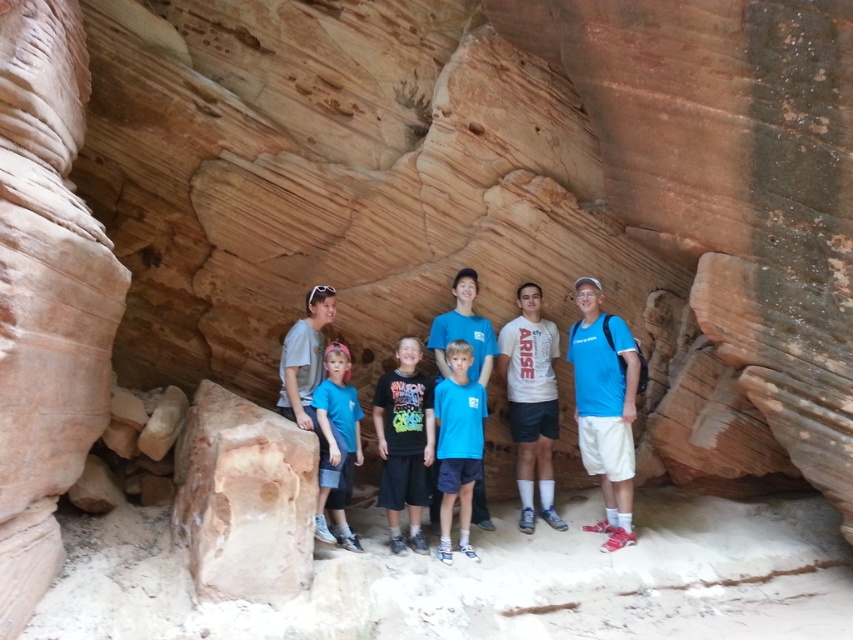
You are standing at the entrance of the rock formation and want to reach the point marked as point (x=407, y=394). If your walking speed is 1.2 meters per second, how many seconds will it take you to reach that point?

The distance between you and point (x=407, y=394) is 9.16 meters. At a speed of 1.2 meters per second, it will take approximately 7.63 seconds to reach the point.

You are navigating through a narrow path between two points in the rock formation. The first point is at coordinate point(601, 362) and the second point is at coordinate point(322, 392). Which point is closer to you as you move forward?

Point(601, 362) is closer to you than point(322, 392) because it is further to the viewer, meaning it is nearer in your line of sight as you move forward.